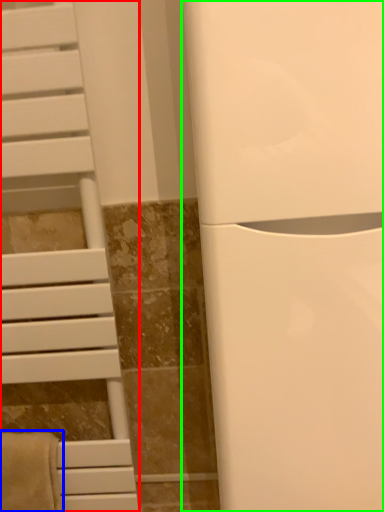
Question: Which object is the closest to the furniture (highlighted by a red box)? Choose among these: bath towel (highlighted by a blue box) or appliance (highlighted by a green box).

Choices:
 (A) bath towel
 (B) appliance

Answer: (A)